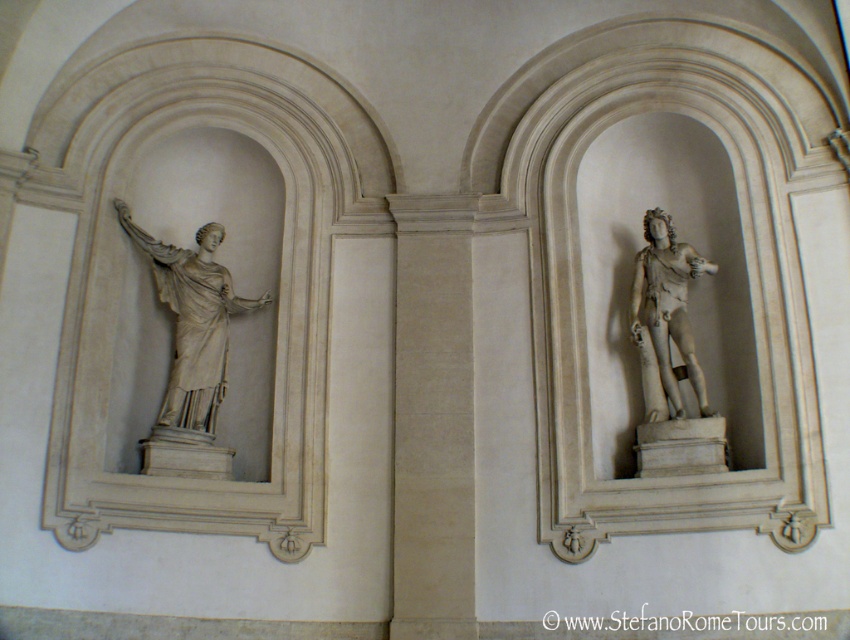
From the picture: You are an art conservator assessing the placement of the white marble statue at left. Based on its coordinates at point 0.505, 0.228, can you determine if it is positioned centrally within its alcove?

The white marble statue at left is located at point (193, 323), which indicates its position relative to the alcove. To determine centrality, we would need the dimensions of the alcove. However, since the coordinates are provided as a single point without context, it is impossible to confirm if it is centrally positioned without additional measurements.